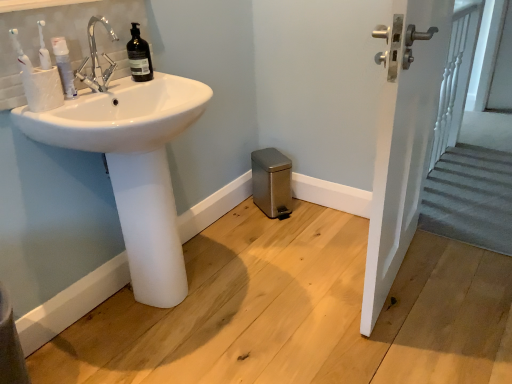
You are a GUI agent. You are given a task and a screenshot of the screen. Output one action in this format:
    pyautogui.click(x=<x>, y=<y>)
    Task: Click on the vacant space to the right of satin silver trash can at lower center
    The height and width of the screenshot is (384, 512).
    Given the screenshot: What is the action you would take?
    pyautogui.click(x=311, y=208)